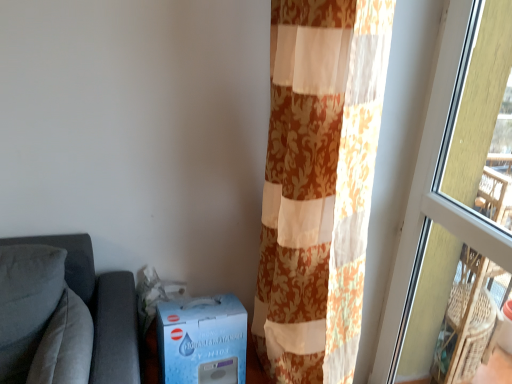
Question: From their relative heights in the image, would you say blue cardboard box at lower left is taller or shorter than floral fabric curtain at right?

Choices:
 (A) tall
 (B) short

Answer: (B)

Question: From a real-world perspective, relative to floral fabric curtain at right, is blue cardboard box at lower left vertically above or below?

Choices:
 (A) below
 (B) above

Answer: (A)

Question: Based on their relative distances, which object is farther from the blue cardboard box at lower left?

Choices:
 (A) suede-like gray pillow at left
 (B) floral fabric curtain at right
 (C) transparent glass window at right

Answer: (C)

Question: Considering the real-world distances, which object is farthest from the transparent glass window at right?

Choices:
 (A) suede-like gray pillow at left
 (B) blue cardboard box at lower left
 (C) floral fabric curtain at right

Answer: (A)